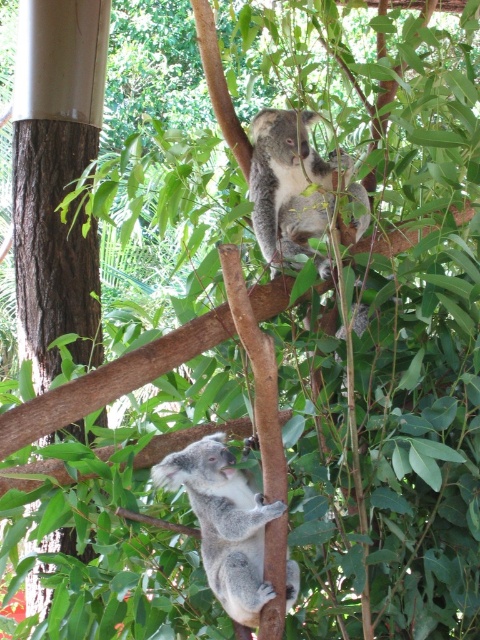
You are a wildlife photographer aiming to capture a photo of both koalas in the same frame. Given that your camera has a maximum focus range of 1 meter, will you be able to focus on both the fuzzy gray koala at lower center and the fuzzy gray koala at upper center simultaneously?

The fuzzy gray koala at lower center is 1.01 meters away from the fuzzy gray koala at upper center. Since the distance between them exceeds the camera maximum focus range of 1 meter, you cannot focus on both simultaneously.